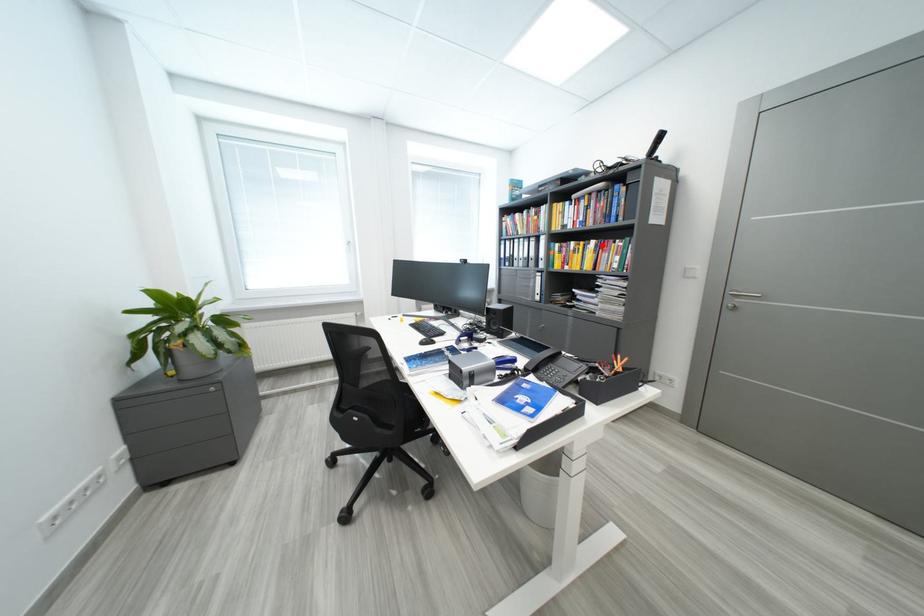
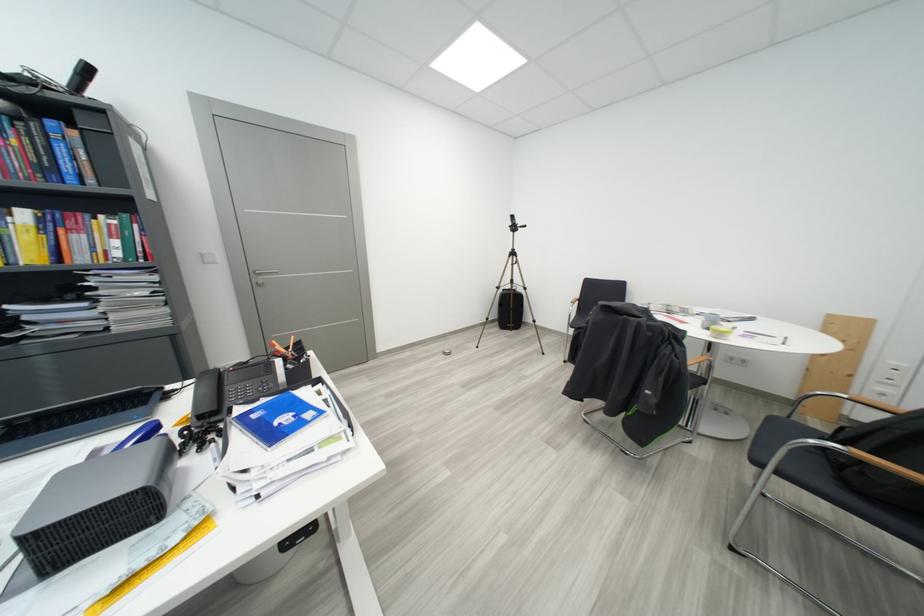
Question: I am providing you with two images of the same scene from different viewpoints. In image1, a red point is highlighted. Considering the same 3D point in image2, which of the following is correct?

Choices:
 (A) It is closer
 (B) It is farther

Answer: (B)